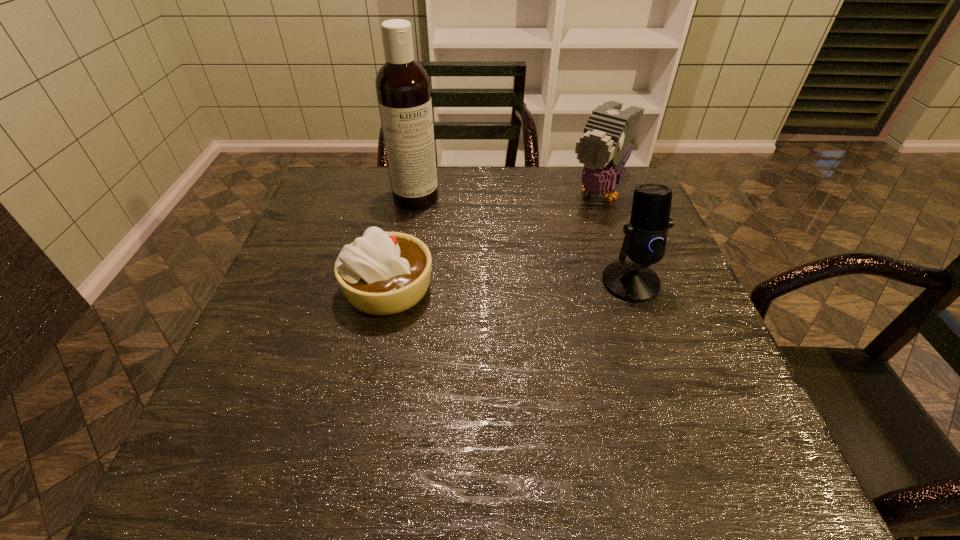
At what (x,y) coordinates should I click in order to perform the action: click on vacant space at the right edge. Please return your answer as a coordinate pair (x, y). The image size is (960, 540). Looking at the image, I should click on (612, 239).

Locate an element on the screen. The width and height of the screenshot is (960, 540). free space at the far left corner of the desktop is located at coordinates (367, 198).

Locate an element on the screen. This screenshot has width=960, height=540. free space at the far right corner of the desktop is located at coordinates (621, 204).

Locate an element on the screen. Image resolution: width=960 pixels, height=540 pixels. vacant area between the shortest object and the bird is located at coordinates (493, 241).

This screenshot has height=540, width=960. In order to click on unoccupied area between the microphone and the shortest object in this screenshot , I will do `click(510, 286)`.

I want to click on free spot between the whipped cream and the bird, so click(x=493, y=241).

In order to click on vacant area that lies between the microphone and the bird in this screenshot , I will do `click(614, 238)`.

You are a GUI agent. You are given a task and a screenshot of the screen. Output one action in this format:
    pyautogui.click(x=<x>, y=<y>)
    Task: Click on the vacant area between the bird and the microphone
    
    Given the screenshot: What is the action you would take?
    pyautogui.click(x=614, y=238)

The height and width of the screenshot is (540, 960). Find the location of `free point between the bird and the microphone`. free point between the bird and the microphone is located at coordinates (614, 238).

In order to click on free spot between the bird and the microphone in this screenshot , I will do `click(614, 238)`.